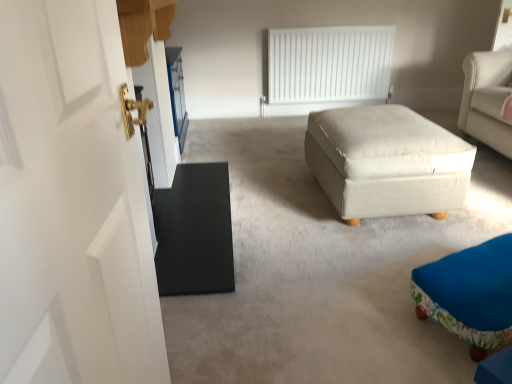
At what (x,y) coordinates should I click in order to perform the action: click on empty space that is ontop of white matte radiator at upper center. Please return your answer as a coordinate pair (x, y). Looking at the image, I should click on (334, 21).